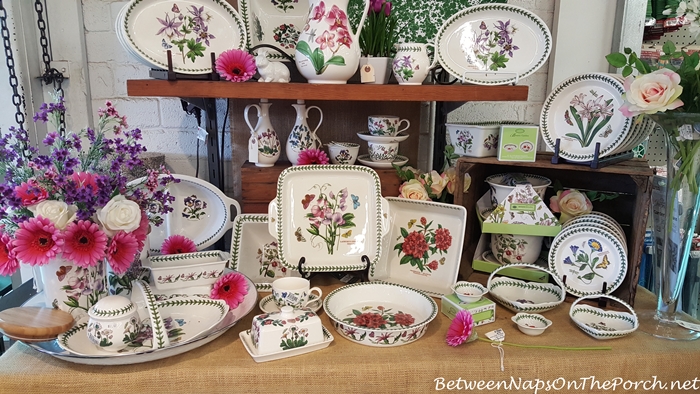
I want to click on flower vases, so click(x=673, y=282), click(x=57, y=281).